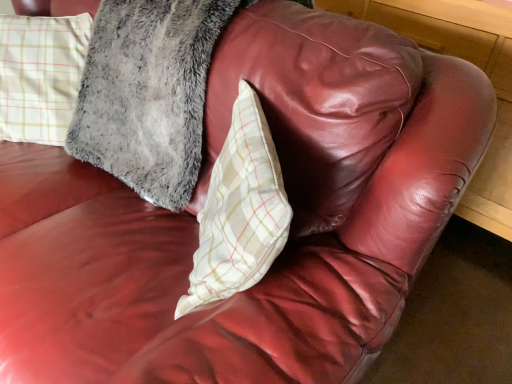
Locate an element on the screen. This screenshot has height=384, width=512. plaid fabric pillow at upper left, arranged as the first pillow when viewed from the left is located at coordinates (148, 93).

What do you see at coordinates (148, 93) in the screenshot? The image size is (512, 384). I see `plaid fabric pillow at upper left, the second pillow from the right` at bounding box center [148, 93].

The width and height of the screenshot is (512, 384). Find the location of `white plaid pillow at center, marked as the second pillow in a left-to-right arrangement`. white plaid pillow at center, marked as the second pillow in a left-to-right arrangement is located at coordinates (239, 210).

What do you see at coordinates (239, 210) in the screenshot? Image resolution: width=512 pixels, height=384 pixels. I see `white plaid pillow at center, the first pillow when ordered from right to left` at bounding box center [239, 210].

Where is `plaid fabric pillow at upper left, arranged as the first pillow when viewed from the left`? This screenshot has width=512, height=384. plaid fabric pillow at upper left, arranged as the first pillow when viewed from the left is located at coordinates (148, 93).

Can you confirm if plaid fabric pillow at upper left, the second pillow from the right, is positioned to the right of white plaid pillow at center, the first pillow when ordered from right to left?

In fact, plaid fabric pillow at upper left, the second pillow from the right, is to the left of white plaid pillow at center, the first pillow when ordered from right to left.

Is plaid fabric pillow at upper left, arranged as the first pillow when viewed from the left, behind white plaid pillow at center, the first pillow when ordered from right to left?

Yes, the depth of plaid fabric pillow at upper left, arranged as the first pillow when viewed from the left, is greater than that of white plaid pillow at center, the first pillow when ordered from right to left.

Is point (169, 23) farther from viewer compared to point (283, 216)?

Yes, point (169, 23) is farther from viewer.

From the image's perspective, relative to white plaid pillow at center, marked as the second pillow in a left-to-right arrangement, is plaid fabric pillow at upper left, arranged as the first pillow when viewed from the left, above or below?

Based on their image positions, plaid fabric pillow at upper left, arranged as the first pillow when viewed from the left, is located above white plaid pillow at center, marked as the second pillow in a left-to-right arrangement.

Based on the photo, from a real-world perspective, is plaid fabric pillow at upper left, arranged as the first pillow when viewed from the left, under white plaid pillow at center, the first pillow when ordered from right to left?

Incorrect, from a real-world perspective, plaid fabric pillow at upper left, arranged as the first pillow when viewed from the left, is higher than white plaid pillow at center, the first pillow when ordered from right to left.

Does plaid fabric pillow at upper left, the second pillow from the right, have a greater width compared to white plaid pillow at center, marked as the second pillow in a left-to-right arrangement?

Yes, plaid fabric pillow at upper left, the second pillow from the right, is wider than white plaid pillow at center, marked as the second pillow in a left-to-right arrangement.

Which of these two, plaid fabric pillow at upper left, the second pillow from the right, or white plaid pillow at center, marked as the second pillow in a left-to-right arrangement, stands shorter?

white plaid pillow at center, marked as the second pillow in a left-to-right arrangement.

Is plaid fabric pillow at upper left, arranged as the first pillow when viewed from the left, bigger or smaller than white plaid pillow at center, marked as the second pillow in a left-to-right arrangement?

In the image, plaid fabric pillow at upper left, arranged as the first pillow when viewed from the left, appears to be larger than white plaid pillow at center, marked as the second pillow in a left-to-right arrangement.

Is plaid fabric pillow at upper left, the second pillow from the right, surrounding white plaid pillow at center, marked as the second pillow in a left-to-right arrangement?

No, white plaid pillow at center, marked as the second pillow in a left-to-right arrangement, is located outside of plaid fabric pillow at upper left, the second pillow from the right.

Is plaid fabric pillow at upper left, the second pillow from the right, not near white plaid pillow at center, the first pillow when ordered from right to left?

Actually, plaid fabric pillow at upper left, the second pillow from the right, and white plaid pillow at center, the first pillow when ordered from right to left, are a little close together.

Is plaid fabric pillow at upper left, the second pillow from the right, looking in the opposite direction of white plaid pillow at center, marked as the second pillow in a left-to-right arrangement?

No, plaid fabric pillow at upper left, the second pillow from the right, is not facing the opposite direction of white plaid pillow at center, marked as the second pillow in a left-to-right arrangement.

In the scene shown: What's the angular difference between plaid fabric pillow at upper left, arranged as the first pillow when viewed from the left, and white plaid pillow at center, the first pillow when ordered from right to left,'s facing directions?

They differ by 51.4 degrees in their facing directions.

Find the location of a particular element. The image size is (512, 384). pillow above the white plaid pillow at center, the first pillow when ordered from right to left (from a real-world perspective) is located at coordinates (148, 93).

Which object is positioned more to the left, white plaid pillow at center, marked as the second pillow in a left-to-right arrangement, or plaid fabric pillow at upper left, the second pillow from the right?

plaid fabric pillow at upper left, the second pillow from the right, is more to the left.

Considering the positions of objects white plaid pillow at center, the first pillow when ordered from right to left, and plaid fabric pillow at upper left, arranged as the first pillow when viewed from the left, in the image provided, who is behind, white plaid pillow at center, the first pillow when ordered from right to left, or plaid fabric pillow at upper left, arranged as the first pillow when viewed from the left,?

plaid fabric pillow at upper left, arranged as the first pillow when viewed from the left, is behind.

Which is behind, point (229, 220) or point (110, 59)?

The point (110, 59) is farther.

Based on the photo, from the image's perspective, between white plaid pillow at center, the first pillow when ordered from right to left, and plaid fabric pillow at upper left, arranged as the first pillow when viewed from the left, who is located below?

white plaid pillow at center, the first pillow when ordered from right to left, appears lower in the image.

From a real-world perspective, relative to plaid fabric pillow at upper left, the second pillow from the right, is white plaid pillow at center, marked as the second pillow in a left-to-right arrangement, vertically above or below?

white plaid pillow at center, marked as the second pillow in a left-to-right arrangement, is below plaid fabric pillow at upper left, the second pillow from the right.

Does white plaid pillow at center, the first pillow when ordered from right to left, have a lesser width compared to plaid fabric pillow at upper left, the second pillow from the right?

Yes, white plaid pillow at center, the first pillow when ordered from right to left, is thinner than plaid fabric pillow at upper left, the second pillow from the right.

Who is taller, white plaid pillow at center, marked as the second pillow in a left-to-right arrangement, or plaid fabric pillow at upper left, the second pillow from the right?

plaid fabric pillow at upper left, the second pillow from the right, is taller.

Can you confirm if white plaid pillow at center, the first pillow when ordered from right to left, is smaller than plaid fabric pillow at upper left, the second pillow from the right?

Indeed, white plaid pillow at center, the first pillow when ordered from right to left, has a smaller size compared to plaid fabric pillow at upper left, the second pillow from the right.

Would you say white plaid pillow at center, marked as the second pillow in a left-to-right arrangement, is inside or outside plaid fabric pillow at upper left, the second pillow from the right?

white plaid pillow at center, marked as the second pillow in a left-to-right arrangement, is spatially situated outside plaid fabric pillow at upper left, the second pillow from the right.

Is the surface of white plaid pillow at center, marked as the second pillow in a left-to-right arrangement, in direct contact with plaid fabric pillow at upper left, arranged as the first pillow when viewed from the left?

white plaid pillow at center, marked as the second pillow in a left-to-right arrangement, and plaid fabric pillow at upper left, arranged as the first pillow when viewed from the left, are not in contact.

In the scene shown: Does white plaid pillow at center, marked as the second pillow in a left-to-right arrangement, turn towards plaid fabric pillow at upper left, the second pillow from the right?

No, white plaid pillow at center, marked as the second pillow in a left-to-right arrangement, is not turned towards plaid fabric pillow at upper left, the second pillow from the right.

Can you tell me how much white plaid pillow at center, marked as the second pillow in a left-to-right arrangement, and plaid fabric pillow at upper left, the second pillow from the right, differ in facing direction?

There is a 51.4-degree angle between the facing directions of white plaid pillow at center, marked as the second pillow in a left-to-right arrangement, and plaid fabric pillow at upper left, the second pillow from the right.

Locate an element on the screen. The image size is (512, 384). pillow that appears behind the white plaid pillow at center, the first pillow when ordered from right to left is located at coordinates [x=148, y=93].

You are a GUI agent. You are given a task and a screenshot of the screen. Output one action in this format:
    pyautogui.click(x=<x>, y=<y>)
    Task: Click on the pillow to the left of white plaid pillow at center, marked as the second pillow in a left-to-right arrangement
    This screenshot has width=512, height=384.
    Given the screenshot: What is the action you would take?
    point(148,93)

Where is `pillow on the right of plaid fabric pillow at upper left, the second pillow from the right`? The width and height of the screenshot is (512, 384). pillow on the right of plaid fabric pillow at upper left, the second pillow from the right is located at coordinates (239, 210).